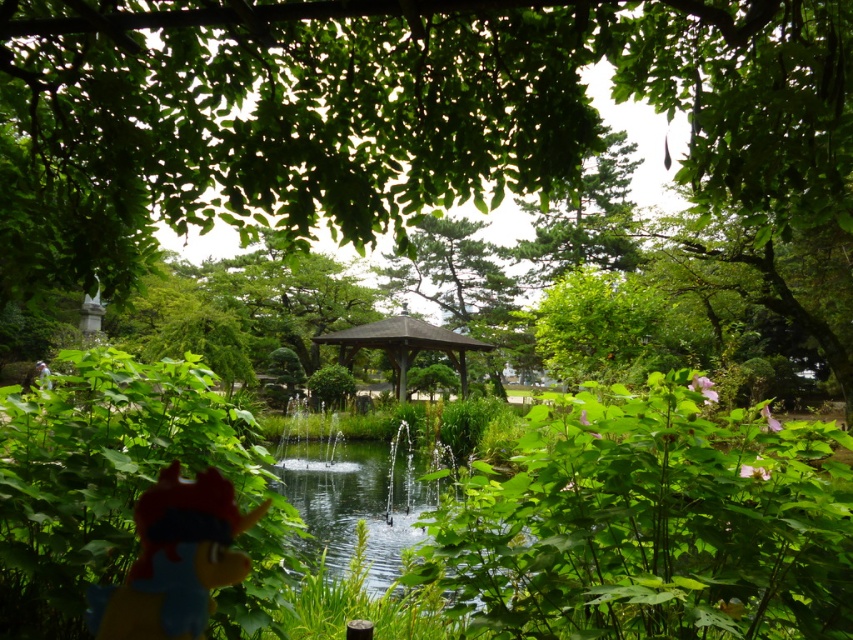
Question: Which of the following is the farthest from the observer?

Choices:
 (A) (381, 275)
 (B) (137, 636)
 (C) (416, 337)

Answer: (A)

Question: Can you confirm if plush red toy at lower left is smaller than brown wooden gazebo at center?

Choices:
 (A) yes
 (B) no

Answer: (A)

Question: Does smooth gray gazebo at center have a greater width compared to brown wooden gazebo at center?

Choices:
 (A) yes
 (B) no

Answer: (A)

Question: Can you confirm if plush red toy at lower left is positioned below smooth gray gazebo at center?

Choices:
 (A) no
 (B) yes

Answer: (B)

Question: Which point is farther to the camera?

Choices:
 (A) (469, 344)
 (B) (415, 252)
 (C) (172, 506)

Answer: (A)

Question: Which point is farther to the camera?

Choices:
 (A) click(444, 234)
 (B) click(231, 486)

Answer: (A)